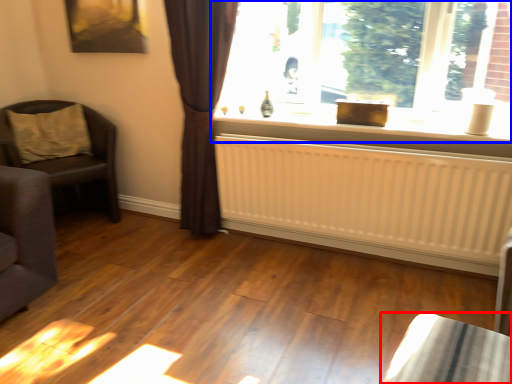
Question: Which object appears farthest to the camera in this image, furniture (highlighted by a red box) or window (highlighted by a blue box)?

Choices:
 (A) furniture
 (B) window

Answer: (B)